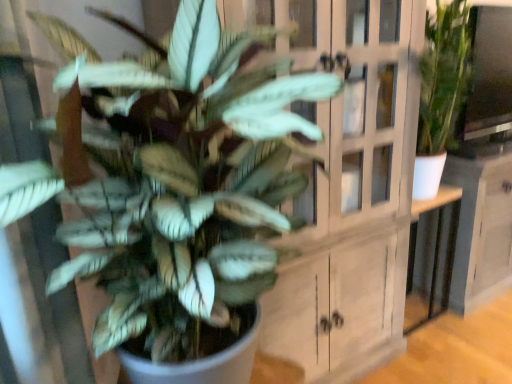
Question: In terms of height, does white glossy table at center look taller or shorter compared to green matte plant at center?

Choices:
 (A) tall
 (B) short

Answer: (B)

Question: In the image, is white glossy table at center positioned in front of or behind green matte plant at center?

Choices:
 (A) behind
 (B) front

Answer: (A)

Question: Estimate the real-world distances between objects in this image. Which object is closer to the white glossy table at center?

Choices:
 (A) white wood cabinet at center
 (B) green matte plant at center

Answer: (A)

Question: Which object is positioned farthest from the white wood cabinet at center?

Choices:
 (A) green matte plant at center
 (B) white glossy table at center

Answer: (B)